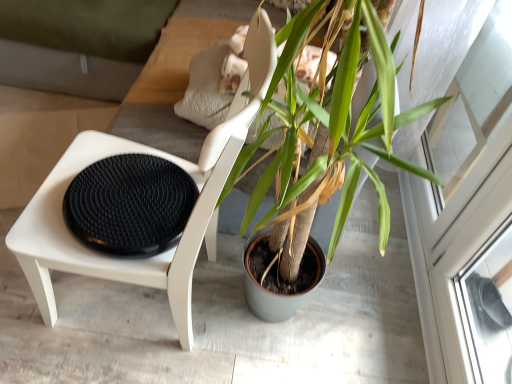
Measure the distance between point (x=86, y=249) and camera.

Point (x=86, y=249) and camera are 1.00 meters apart from each other.

At what (x,y) coordinates should I click in order to perform the action: click on black textured footrest at left. Please return your answer as a coordinate pair (x, y). Image resolution: width=512 pixels, height=384 pixels. Looking at the image, I should click on (130, 205).

Find the location of `green matte plant pot at center`. green matte plant pot at center is located at coordinates (221, 322).

Measure the distance between point (458, 296) and camera.

Point (458, 296) is 4.34 feet from camera.

Describe the element at coordinates (467, 216) in the screenshot. The width and height of the screenshot is (512, 384). I see `transparent glass screen door at upper right` at that location.

This screenshot has width=512, height=384. Find the location of `white matte chair at left`. white matte chair at left is located at coordinates (187, 222).

Between green matte plant at center and green matte plant pot at center, which one has smaller width?

With smaller width is green matte plant pot at center.

In terms of height, does green matte plant at center look taller or shorter compared to green matte plant pot at center?

In the image, green matte plant at center appears to be taller than green matte plant pot at center.

Who is smaller, green matte plant at center or green matte plant pot at center?

green matte plant pot at center.

Would you say green matte plant at center is inside or outside green matte plant pot at center?

green matte plant at center is located beyond the bounds of green matte plant pot at center.

Is green matte plant pot at center facing towards green matte plant at center?

No, green matte plant pot at center is not facing towards green matte plant at center.

How distant is green matte plant pot at center from green matte plant at center?

green matte plant pot at center and green matte plant at center are 21.67 inches apart.

Considering the relative sizes of green matte plant pot at center and green matte plant at center in the image provided, is green matte plant pot at center wider than green matte plant at center?

In fact, green matte plant pot at center might be narrower than green matte plant at center.

Is green matte plant pot at center far away from green matte plant at center?

That's not correct — green matte plant pot at center is a little close to green matte plant at center.

From a real-world perspective, is green matte plant pot at center above or below black textured footrest at left?

Clearly, from a real-world perspective, green matte plant pot at center is below black textured footrest at left.

Which is more to the right, green matte plant pot at center or black textured footrest at left?

From the viewer's perspective, black textured footrest at left appears more on the right side.

Is green matte plant pot at center located outside black textured footrest at left?

Yes, green matte plant pot at center is located beyond the bounds of black textured footrest at left.

In the image, is green matte plant pot at center positioned in front of or behind black textured footrest at left?

green matte plant pot at center is positioned farther from the viewer than black textured footrest at left.

Relative to green matte plant pot at center, is black textured footrest at left in front or behind?

black textured footrest at left is in front of green matte plant pot at center.

Is black textured footrest at left next to green matte plant pot at center and touching it?

No, black textured footrest at left is not beside green matte plant pot at center.

Which of these two, black textured footrest at left or green matte plant pot at center, is wider?

green matte plant pot at center.

From a real-world perspective, is black textured footrest at left on top of green matte plant pot at center?

Yes, from a real-world perspective, black textured footrest at left is on top of green matte plant pot at center.

Which object is positioned more to the right, transparent glass screen door at upper right or white matte chair at left?

transparent glass screen door at upper right.

Locate an element on the screen. The width and height of the screenshot is (512, 384). screen door on the right of white matte chair at left is located at coordinates (467, 216).

Could you tell me if transparent glass screen door at upper right is turned towards white matte chair at left?

Yes, transparent glass screen door at upper right is facing white matte chair at left.

Does transparent glass screen door at upper right contain white matte chair at left?

No, transparent glass screen door at upper right does not contain white matte chair at left.

Identify the location of chair below the black textured footrest at left (from the image's perspective). (187, 222).

From a real-world perspective, is black textured footrest at left physically above white matte chair at left?

Yes, from a real-world perspective, black textured footrest at left is above white matte chair at left.

Looking at this image, in the image, is black textured footrest at left on the left side or the right side of white matte chair at left?

Clearly, black textured footrest at left is on the left of white matte chair at left in the image.

Is black textured footrest at left far away from white matte chair at left?

That's not correct — black textured footrest at left is a little close to white matte chair at left.

Identify the location of houseplant above the transparent glass screen door at upper right (from a real-world perspective). This screenshot has height=384, width=512. coord(336,122).

Relative to green matte plant at center, is transparent glass screen door at upper right in front or behind?

In the image, transparent glass screen door at upper right appears behind green matte plant at center.

Is transparent glass screen door at upper right at the right side of green matte plant at center?

Indeed, transparent glass screen door at upper right is positioned on the right side of green matte plant at center.

Looking at this image, does transparent glass screen door at upper right touch green matte plant at center?

They are not placed beside each other.

Where is `concrete on the left side of green matte plant at center`? concrete on the left side of green matte plant at center is located at coordinates (221, 322).

This screenshot has height=384, width=512. What are the coordinates of `houseplant on the right of the green matte plant pot at center` in the screenshot? It's located at (336, 122).

When comparing their distances from green matte plant pot at center, does white matte chair at left or black textured footrest at left seem further?

black textured footrest at left.

Which object lies further to the anchor point black textured footrest at left, green matte plant pot at center or green matte plant at center?

green matte plant pot at center is positioned further to the anchor black textured footrest at left.

Looking at the image, which one is located further to transparent glass screen door at upper right, green matte plant at center or green matte plant pot at center?

The object further to transparent glass screen door at upper right is green matte plant at center.

Considering their positions, is green matte plant pot at center positioned closer to green matte plant at center than white matte chair at left?

The object closer to green matte plant at center is white matte chair at left.

Considering their positions, is green matte plant pot at center positioned further to white matte chair at left than black textured footrest at left?

green matte plant pot at center is positioned further to the anchor white matte chair at left.

From the image, which object appears to be farther from green matte plant at center, black textured footrest at left or green matte plant pot at center?

Based on the image, green matte plant pot at center appears to be further to green matte plant at center.

When comparing their distances from green matte plant pot at center, does black textured footrest at left or green matte plant at center seem closer?

Based on the image, black textured footrest at left appears to be nearer to green matte plant pot at center.

From the image, which object appears to be nearer to transparent glass screen door at upper right, black textured footrest at left or green matte plant at center?

green matte plant at center is closer to transparent glass screen door at upper right.

At what (x,y) coordinates should I click in order to perform the action: click on footrest between green matte plant at center and green matte plant pot at center from top to bottom. Please return your answer as a coordinate pair (x, y). This screenshot has height=384, width=512. Looking at the image, I should click on (130, 205).

The height and width of the screenshot is (384, 512). Identify the location of houseplant located between black textured footrest at left and transparent glass screen door at upper right in the left-right direction. (336, 122).

Image resolution: width=512 pixels, height=384 pixels. I want to click on the footrest positioned between white matte chair at left and green matte plant pot at center from near to far, so click(130, 205).

Identify the location of chair between green matte plant at center and green matte plant pot at center in the vertical direction. (187, 222).